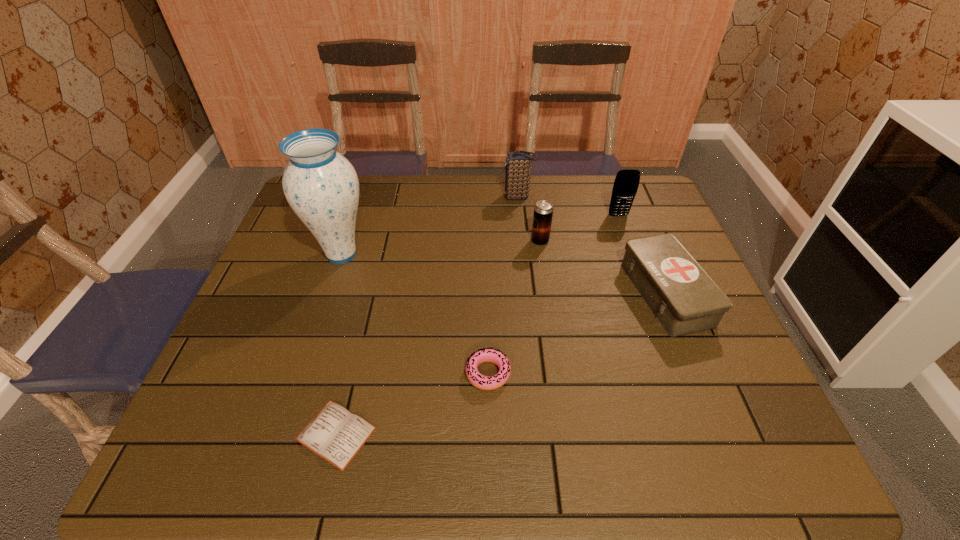
Locate an element on the screen. empty location between the fourth tallest object and the shortest object is located at coordinates (438, 338).

I want to click on blank region between the fourth shortest object and the third object from left to right, so click(514, 307).

Locate an element on the screen. This screenshot has height=540, width=960. blank region between the sixth farthest object and the shortest object is located at coordinates (412, 403).

Identify the location of free point between the fifth object from right to left and the tallest object. The width and height of the screenshot is (960, 540). (415, 314).

What are the coordinates of `empty location between the vase and the nearest object` in the screenshot? It's located at (339, 344).

Find the location of a particular element. free space between the beer can and the first-aid kit is located at coordinates (603, 267).

Locate an element on the screen. vacant area that lies between the beer can and the third shortest object is located at coordinates (603, 267).

This screenshot has height=540, width=960. Find the location of `unoccupied position between the nearest object and the fourth tallest object`. unoccupied position between the nearest object and the fourth tallest object is located at coordinates (438, 338).

Locate an element on the screen. The height and width of the screenshot is (540, 960). empty space between the vase and the second shortest object is located at coordinates (415, 314).

Locate which object ranks third in proximity to the sixth farthest object. Please provide its 2D coordinates. Your answer should be formatted as a tuple, i.e. [(x, y)], where the tuple contains the x and y coordinates of a point satisfying the conditions above.

[(321, 186)]